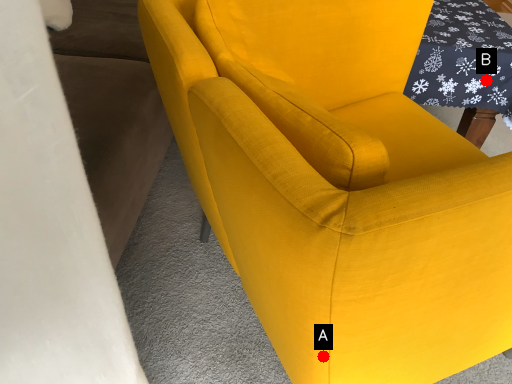
Question: Two points are circled on the image, labeled by A and B beside each circle. Which point is closer to the camera?

Choices:
 (A) A is closer
 (B) B is closer

Answer: (A)